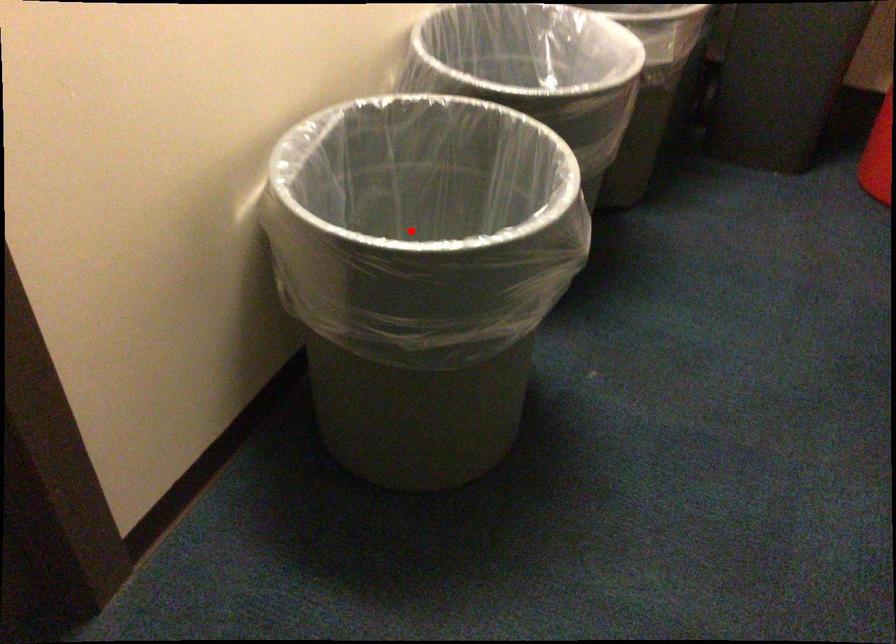
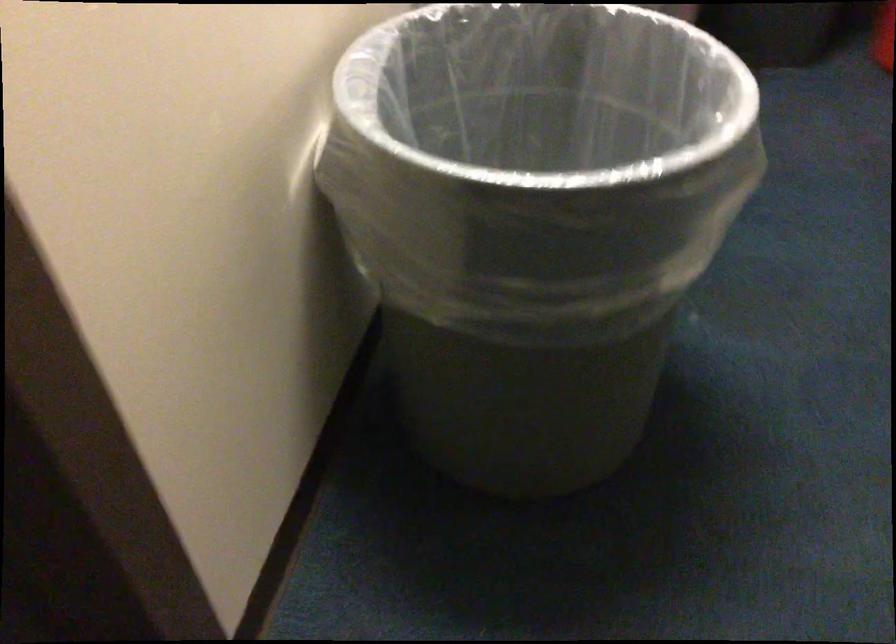
Question: I am providing you with two images of the same scene from different viewpoints. A red point is marked on the first image. Is the red point's position out of view in image 2?

Choices:
 (A) Yes
 (B) No

Answer: (A)